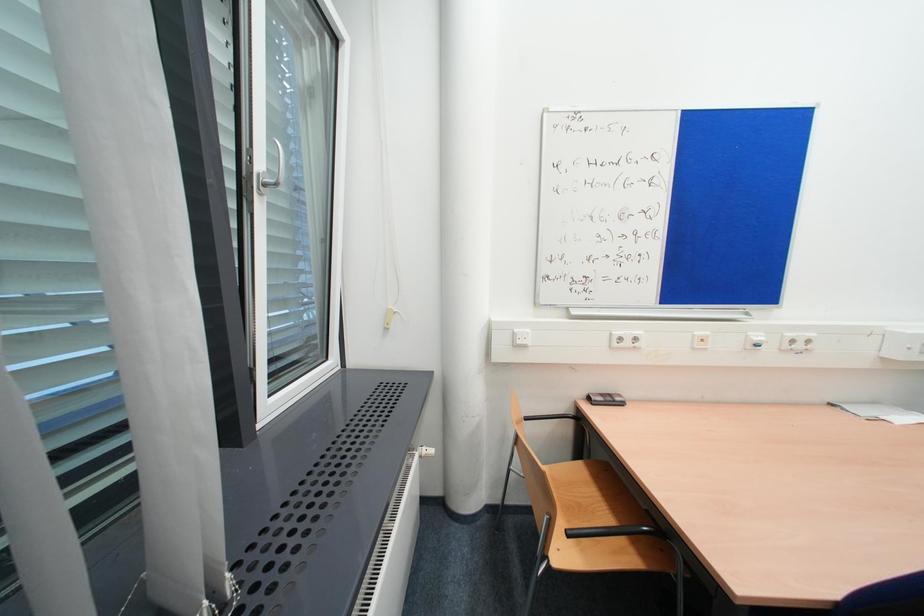
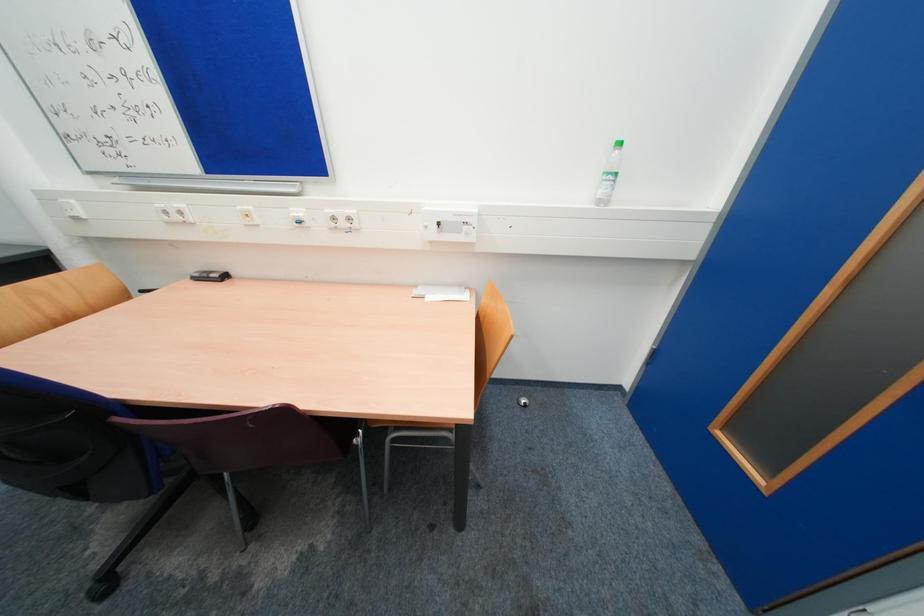
Question: Which direction would the cameraman need to move to produce the second image? Reply with the corresponding letter.

Choices:
 (A) Left
 (B) Right
 (C) Forward
 (D) Backward

Answer: (B)